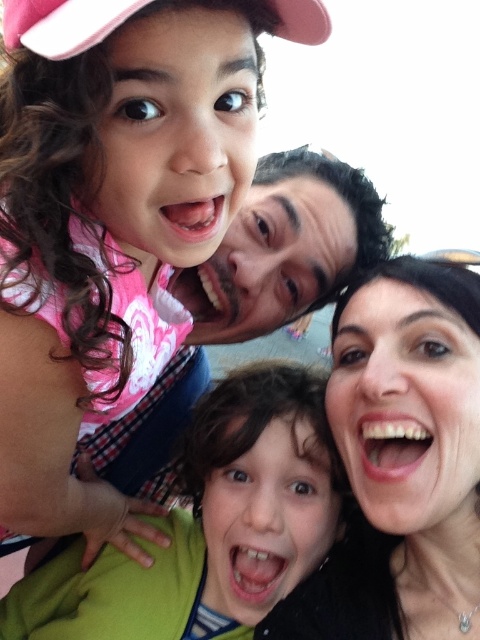
Question: Which point is farther to the camera?

Choices:
 (A) green fabric shirt at center
 (B) pink fabric at upper left

Answer: (A)

Question: Does smooth skin face at upper right come in front of pink fabric baseball cap at upper left?

Choices:
 (A) no
 (B) yes

Answer: (A)

Question: Does smooth skin face at upper right appear on the left side of green fabric shirt at center?

Choices:
 (A) yes
 (B) no

Answer: (B)

Question: Considering the real-world distances, which object is farthest from the green fabric shirt at center?

Choices:
 (A) pink fabric at upper left
 (B) matte black face at center
 (C) pink fabric baseball cap at upper left

Answer: (C)

Question: Which object is farther from the camera taking this photo?

Choices:
 (A) pink fabric at upper left
 (B) smooth skin face at upper right

Answer: (B)

Question: Does smooth skin face at upper right appear under matte black face at center?

Choices:
 (A) no
 (B) yes

Answer: (B)